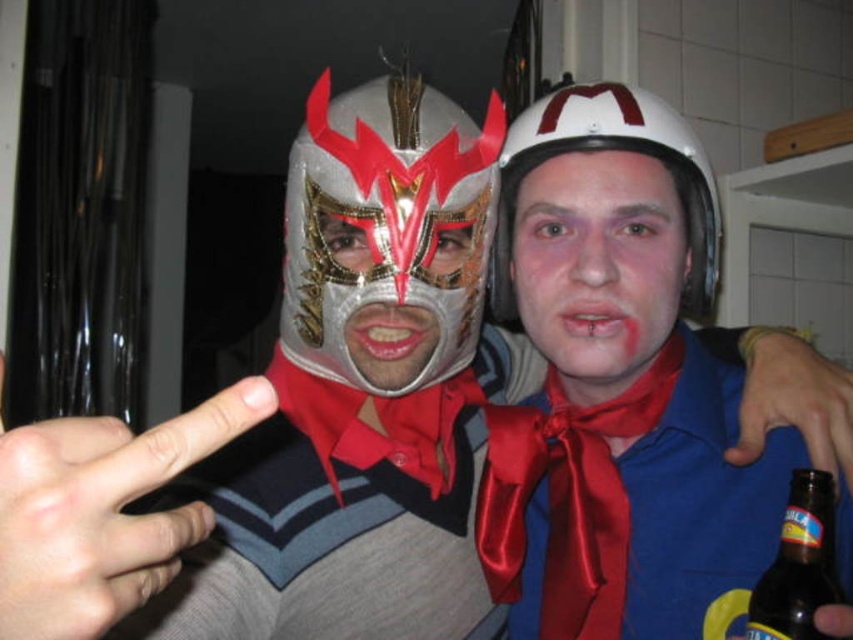
Who is lower down, silver metallic mask at center or matte white helmet at center?

matte white helmet at center

Can you confirm if silver metallic mask at center is wider than matte white helmet at center?

Yes.

Locate an element on the screen. This screenshot has width=853, height=640. silver metallic mask at center is located at coordinates (386, 220).

Locate an element on the screen. silver metallic mask at center is located at coordinates (386, 220).

Can you confirm if matte white helmet at center is positioned to the right of metallic silver mask at center?

Correct, you'll find matte white helmet at center to the right of metallic silver mask at center.

Between matte white helmet at center and metallic silver mask at center, which one appears on the left side from the viewer's perspective?

metallic silver mask at center is more to the left.

Who is more forward, (624, 305) or (360, 218)?

Point (360, 218) is more forward.

The width and height of the screenshot is (853, 640). Find the location of `matte white helmet at center`. matte white helmet at center is located at coordinates (598, 264).

The image size is (853, 640). Describe the element at coordinates (614, 148) in the screenshot. I see `white matte helmet at center` at that location.

Which is more to the right, white matte helmet at center or metallic silver mask at center?

white matte helmet at center is more to the right.

Identify the location of white matte helmet at center. (614, 148).

Identify the location of white matte helmet at center. The height and width of the screenshot is (640, 853). (614, 148).